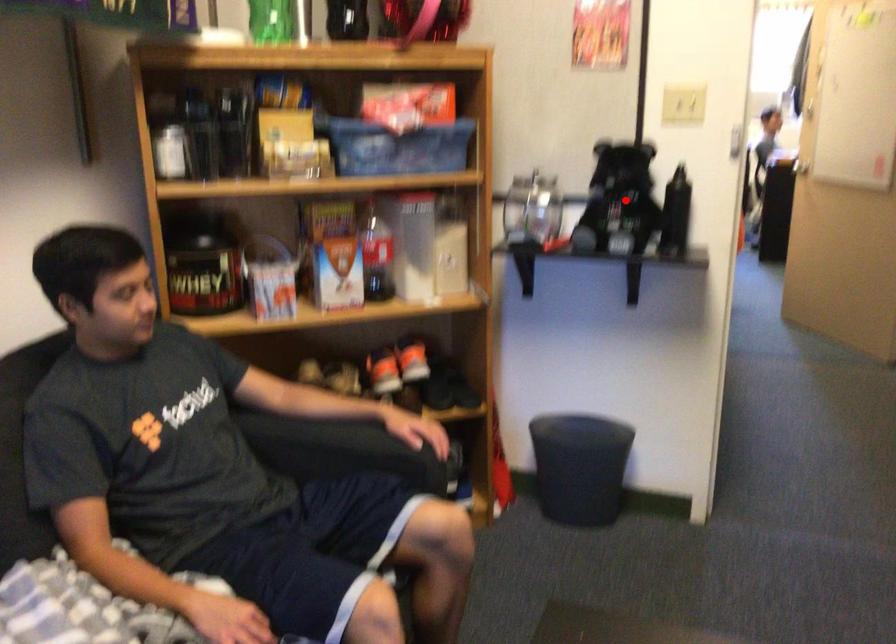
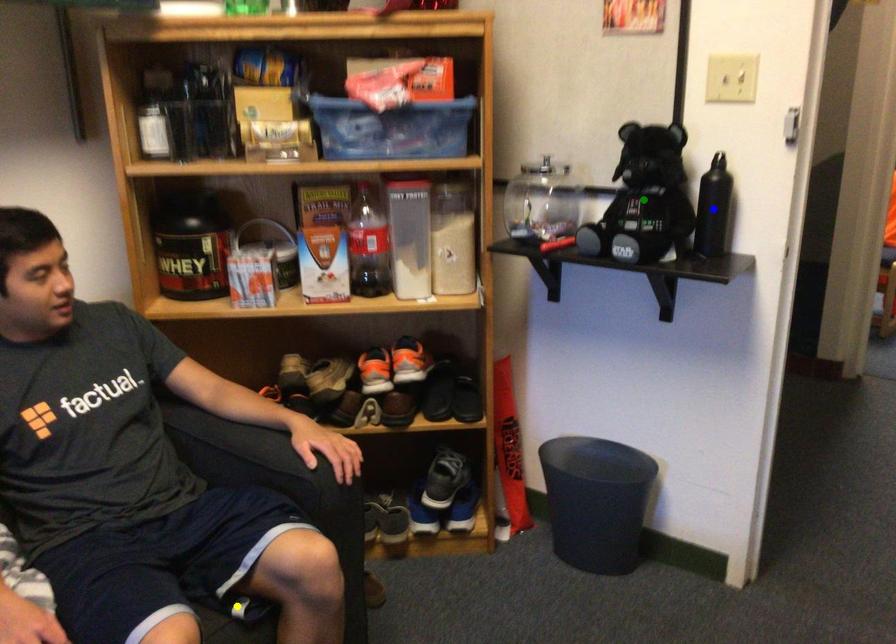
Question: I am providing you with two images of the same scene from different viewpoints. A red point is marked on the first image. You are given multiple points on the second image. Which point in image 2 represents the same 3d spot as the red point in image 1?

Choices:
 (A) blue point
 (B) yellow point
 (C) green point

Answer: (C)